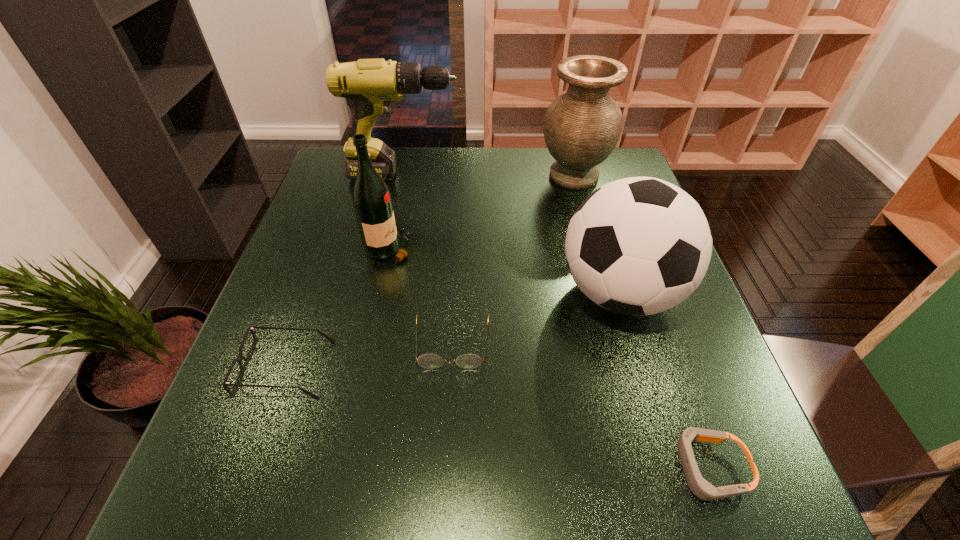
Locate an element on the screen. drill that is at the left edge is located at coordinates (372, 84).

At what (x,y) coordinates should I click in order to perform the action: click on spectacles that is at the left edge. Please return your answer as a coordinate pair (x, y). This screenshot has height=540, width=960. Looking at the image, I should click on (240, 357).

What are the coordinates of `vase that is at the right edge` in the screenshot? It's located at (582, 126).

This screenshot has height=540, width=960. Find the location of `soccer ball positioned at the right edge`. soccer ball positioned at the right edge is located at coordinates (637, 246).

Where is `goggles at the right edge`? goggles at the right edge is located at coordinates (701, 488).

Find the location of a particular element. This screenshot has width=960, height=540. object located at the far left corner is located at coordinates (372, 84).

The height and width of the screenshot is (540, 960). Identify the location of object located at the far right corner. (582, 126).

The height and width of the screenshot is (540, 960). I want to click on object that is at the near right corner, so click(x=701, y=488).

In order to click on vacant space at the far edge of the desktop in this screenshot , I will do `click(413, 153)`.

Where is `free space at the near edge of the desktop`? This screenshot has width=960, height=540. free space at the near edge of the desktop is located at coordinates (658, 483).